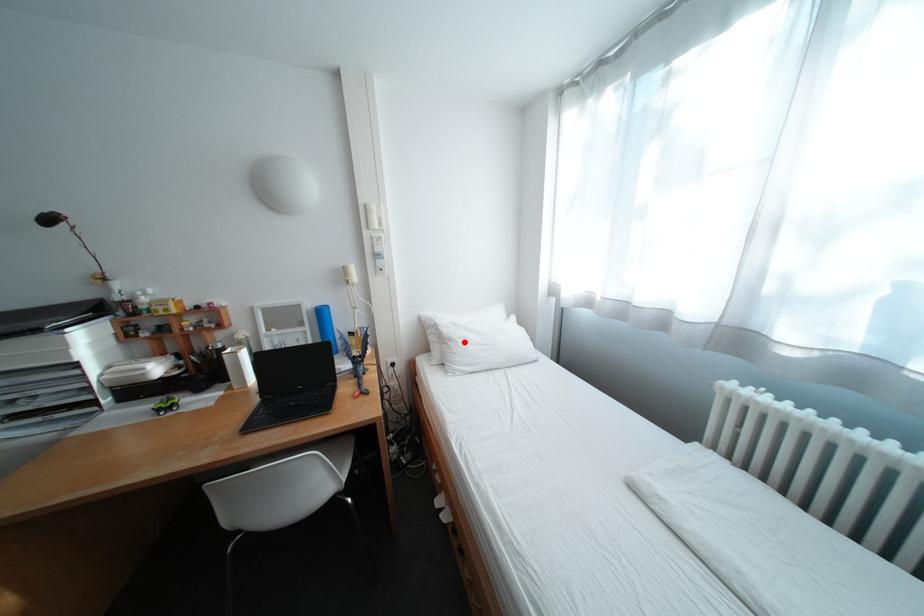
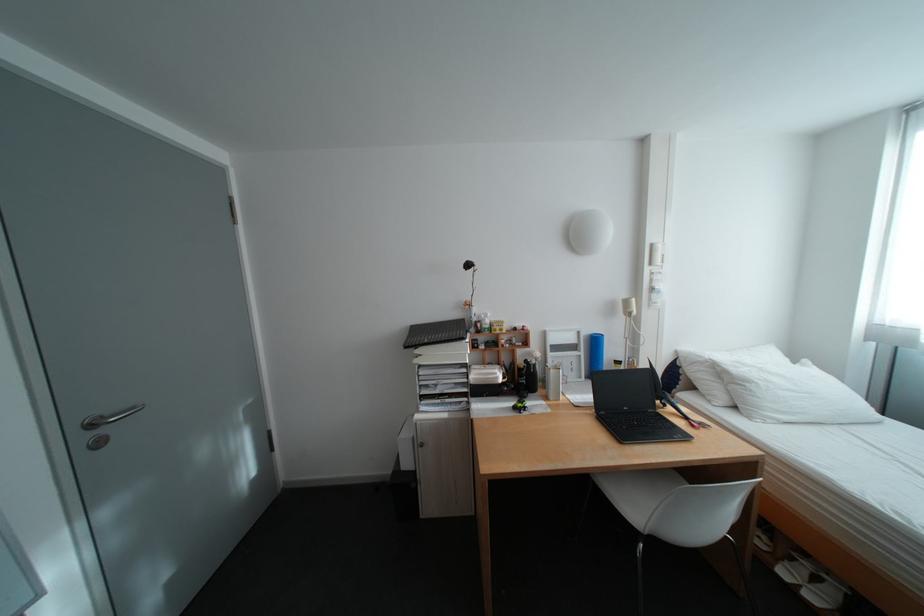
Locate, in the second image, the point that corresponds to the highlighted location in the first image.

(761, 384)